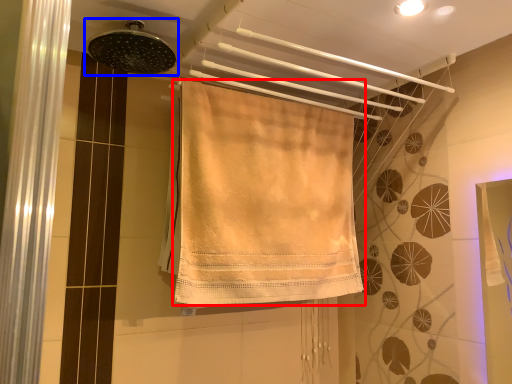
Question: Which object appears farthest to the camera in this image, towel (highlighted by a red box) or shower (highlighted by a blue box)?

Choices:
 (A) towel
 (B) shower

Answer: (A)